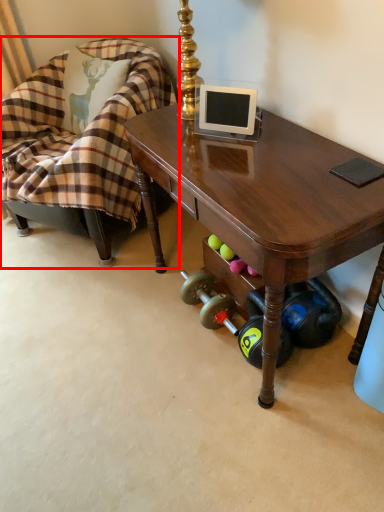
Question: From the image's perspective, what is the correct spatial relationship of chair (annotated by the red box) in relation to desk?

Choices:
 (A) below
 (B) above

Answer: (B)